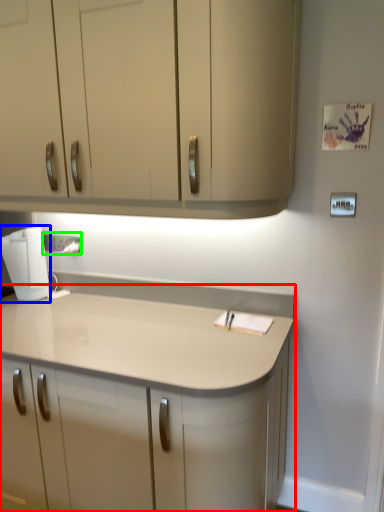
Question: Which is farther away from countertop (highlighted by a red box)? home appliance (highlighted by a blue box) or electric outlet (highlighted by a green box)?

Choices:
 (A) home appliance
 (B) electric outlet

Answer: (B)